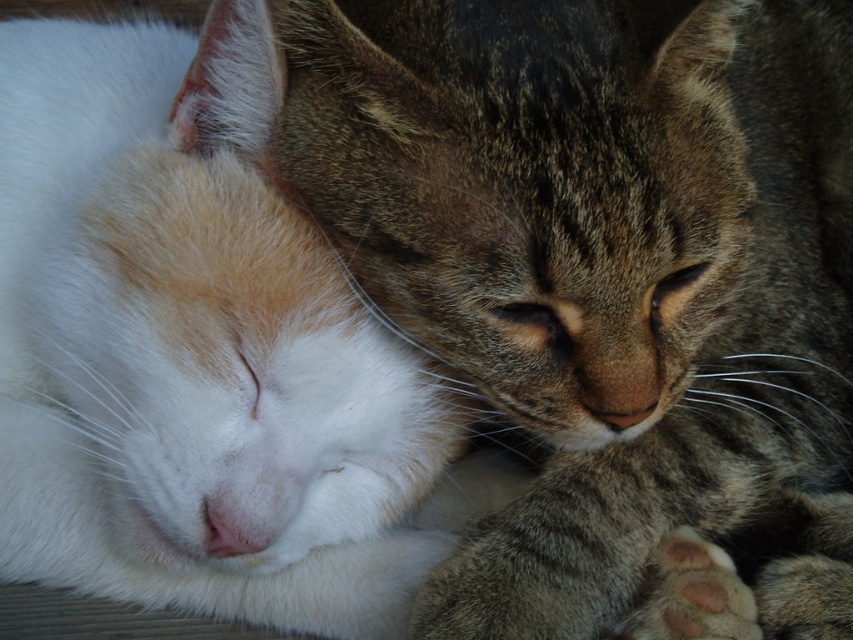
You are a veterinarian examining two cats in an exam room. You notice the tabby fur paw at center and the dark gray fur paw at lower right. Which paw is higher up in the image?

The tabby fur paw at center is taller than the dark gray fur paw at lower right, so the tabby fur paw at center is higher up in the image.

Looking at the two paws in the image, the tabby fur paw at center and the dark gray fur paw at lower right, which one is positioned more to the left side of the image?

The tabby fur paw at center is positioned more to the left side of the image than the dark gray fur paw at lower right.